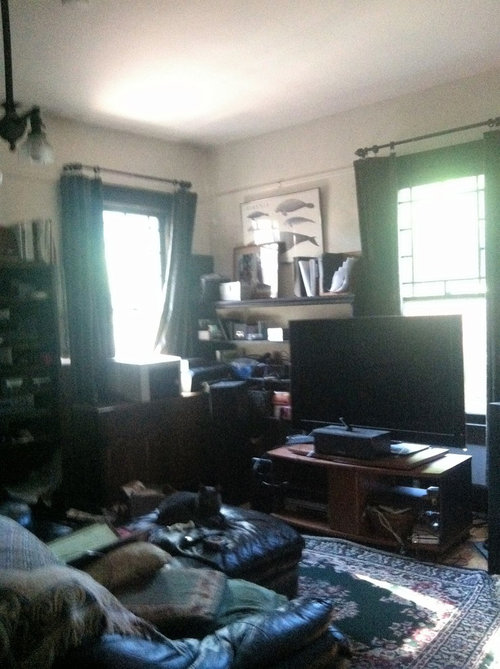
Where is `area rug`? This screenshot has height=669, width=500. area rug is located at coordinates (381, 617).